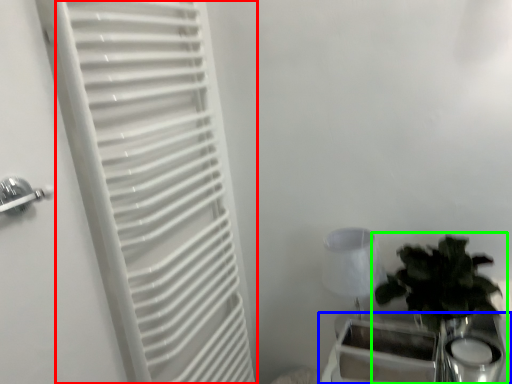
Question: Which is farther away from curtain (highlighted by a red box)? table (highlighted by a blue box) or houseplant (highlighted by a green box)?

Choices:
 (A) table
 (B) houseplant

Answer: (B)